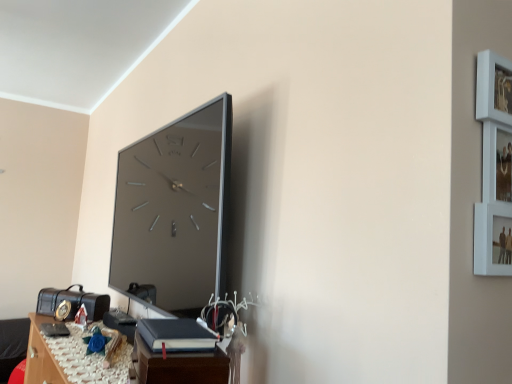
Image resolution: width=512 pixels, height=384 pixels. Describe the element at coordinates (176, 335) in the screenshot. I see `black leather book at lower center` at that location.

Describe the element at coordinates (178, 354) in the screenshot. I see `dark brown wood table at lower center, which ranks as the first table in top-to-bottom order` at that location.

This screenshot has width=512, height=384. In order to click on wooden table at lower left, arranged as the first table when ordered from the bottom in this screenshot , I will do [69, 358].

Between dark brown wood table at lower center, which ranks as the first table in top-to-bottom order, and black leather book at lower center, which one is positioned in front?

dark brown wood table at lower center, which ranks as the first table in top-to-bottom order, is closer to the camera.

Looking at this image, could black leather book at lower center be considered to be inside dark brown wood table at lower center, arranged as the 1th table when viewed from the right?

No, black leather book at lower center is located outside of dark brown wood table at lower center, arranged as the 1th table when viewed from the right.

Is point (160, 352) positioned before point (170, 345)?

Yes, point (160, 352) is in front of point (170, 345).

Could you tell me if dark brown wood table at lower center, which ranks as the first table in top-to-bottom order, is turned towards black leather book at lower center?

No, dark brown wood table at lower center, which ranks as the first table in top-to-bottom order, is not facing towards black leather book at lower center.

Are black leather book at lower center and wooden table at lower left, the first table in the back-to-front sequence, making contact?

No, black leather book at lower center is not touching wooden table at lower left, the first table in the back-to-front sequence.

Who is smaller, black leather book at lower center or wooden table at lower left, arranged as the second table when viewed from the right?

Smaller between the two is black leather book at lower center.

Could you tell me if black leather book at lower center is facing wooden table at lower left, the first table in the back-to-front sequence?

No.

Is the depth of black leather book at lower center greater than that of wooden table at lower left, which ranks as the 1th table in left-to-right order?

No.

Can you see wooden table at lower left, arranged as the second table when viewed from the right, touching dark brown wood table at lower center, which is the 1th table from front to back?

No, wooden table at lower left, arranged as the second table when viewed from the right, is not touching dark brown wood table at lower center, which is the 1th table from front to back.

Considering the relative positions of wooden table at lower left, which ranks as the 1th table in left-to-right order, and dark brown wood table at lower center, which is the 1th table from front to back, in the image provided, is wooden table at lower left, which ranks as the 1th table in left-to-right order, to the right of dark brown wood table at lower center, which is the 1th table from front to back, from the viewer's perspective?

No, wooden table at lower left, which ranks as the 1th table in left-to-right order, is not to the right of dark brown wood table at lower center, which is the 1th table from front to back.

Is wooden table at lower left, arranged as the second table when viewed from the right, not inside dark brown wood table at lower center, which ranks as the first table in top-to-bottom order?

Yes, wooden table at lower left, arranged as the second table when viewed from the right, is located beyond the bounds of dark brown wood table at lower center, which ranks as the first table in top-to-bottom order.

Which object is further away from the camera, black leather book at lower center or dark brown wood table at lower center, arranged as the 1th table when viewed from the right?

black leather book at lower center is behind.

Is black leather book at lower center smaller than dark brown wood table at lower center, which ranks as the second table in left-to-right order?

Yes, black leather book at lower center is smaller than dark brown wood table at lower center, which ranks as the second table in left-to-right order.

From the image's perspective, is black leather book at lower center on dark brown wood table at lower center, which is the 1th table from front to back?

Correct, black leather book at lower center appears higher than dark brown wood table at lower center, which is the 1th table from front to back, in the image.

Is black leather book at lower center not inside dark brown wood table at lower center, arranged as the 1th table when viewed from the right?

That's correct, black leather book at lower center is outside of dark brown wood table at lower center, arranged as the 1th table when viewed from the right.

Can you see dark brown wood table at lower center, which ranks as the first table in top-to-bottom order, touching wooden table at lower left, the first table in the back-to-front sequence?

No, dark brown wood table at lower center, which ranks as the first table in top-to-bottom order, is not making contact with wooden table at lower left, the first table in the back-to-front sequence.

Between dark brown wood table at lower center, which ranks as the second table in left-to-right order, and wooden table at lower left, which ranks as the 1th table in left-to-right order, which one has smaller width?

Thinner between the two is dark brown wood table at lower center, which ranks as the second table in left-to-right order.

Does point (201, 360) come behind point (47, 343)?

No, (201, 360) is closer to viewer.

Can you tell me how much dark brown wood table at lower center, arranged as the 1th table when viewed from the right, and wooden table at lower left, arranged as the first table when ordered from the bottom, differ in facing direction?

The facing directions of dark brown wood table at lower center, arranged as the 1th table when viewed from the right, and wooden table at lower left, arranged as the first table when ordered from the bottom, are 12.8 degrees apart.

From a real-world perspective, between wooden table at lower left, arranged as the first table when ordered from the bottom, and black leather book at lower center, who is vertically higher?

black leather book at lower center is physically above.

From their relative heights in the image, would you say wooden table at lower left, the 2th table in the top-to-bottom sequence, is taller or shorter than black leather book at lower center?

Clearly, wooden table at lower left, the 2th table in the top-to-bottom sequence, is shorter compared to black leather book at lower center.

Is wooden table at lower left, arranged as the second table when viewed from the right, further to camera compared to black leather book at lower center?

Yes, wooden table at lower left, arranged as the second table when viewed from the right, is further from the camera.

Does point (159, 359) appear closer or farther from the camera than point (164, 326)?

Point (159, 359).

Where is `book behind the dark brown wood table at lower center, placed as the 2th table when sorted from bottom to top`? book behind the dark brown wood table at lower center, placed as the 2th table when sorted from bottom to top is located at coordinates (176, 335).

Where is `book that is in front of the wooden table at lower left, arranged as the second table when viewed from the right`? Image resolution: width=512 pixels, height=384 pixels. book that is in front of the wooden table at lower left, arranged as the second table when viewed from the right is located at coordinates (176, 335).

From the image, which object appears to be farther from dark brown wood table at lower center, which ranks as the second table in left-to-right order, black leather book at lower center or wooden table at lower left, arranged as the first table when ordered from the bottom?

wooden table at lower left, arranged as the first table when ordered from the bottom, lies further to dark brown wood table at lower center, which ranks as the second table in left-to-right order, than the other object.

Looking at the image, which one is located further to wooden table at lower left, arranged as the second table when viewed from the right, dark brown wood table at lower center, arranged as the 1th table when viewed from the right, or black leather book at lower center?

black leather book at lower center lies further to wooden table at lower left, arranged as the second table when viewed from the right, than the other object.

Based on their spatial positions, is dark brown wood table at lower center, arranged as the 1th table when viewed from the right, or wooden table at lower left, which ranks as the 1th table in left-to-right order, further from black leather book at lower center?

Among the two, wooden table at lower left, which ranks as the 1th table in left-to-right order, is located further to black leather book at lower center.

Considering their positions, is wooden table at lower left, the first table in the back-to-front sequence, positioned further to black leather book at lower center than dark brown wood table at lower center, which ranks as the first table in top-to-bottom order?

wooden table at lower left, the first table in the back-to-front sequence, lies further to black leather book at lower center than the other object.

Considering their positions, is black leather book at lower center positioned closer to wooden table at lower left, which is the second table from front to back, than dark brown wood table at lower center, the 2th table when ordered from back to front?

Among the two, dark brown wood table at lower center, the 2th table when ordered from back to front, is located nearer to wooden table at lower left, which is the second table from front to back.

Estimate the real-world distances between objects in this image. Which object is closer to dark brown wood table at lower center, the 2th table when ordered from back to front, wooden table at lower left, which ranks as the 1th table in left-to-right order, or black leather book at lower center?

black leather book at lower center is positioned closer to the anchor dark brown wood table at lower center, the 2th table when ordered from back to front.

This screenshot has height=384, width=512. Identify the location of table situated between wooden table at lower left, which is the second table from front to back, and black leather book at lower center from left to right. coord(178,354).